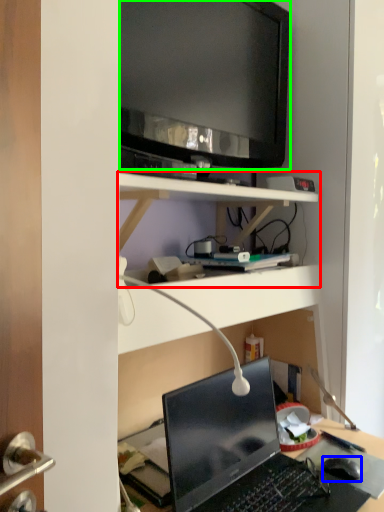
Question: Which object is positioned farthest from shelf (highlighted by a red box)? Select from computer mouse (highlighted by a blue box) and television (highlighted by a green box).

Choices:
 (A) computer mouse
 (B) television

Answer: (A)